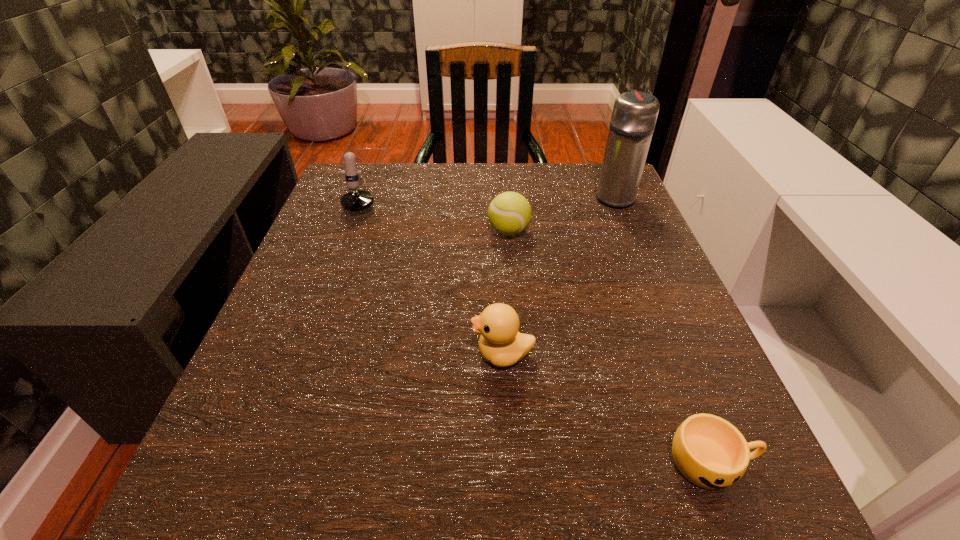
At what (x,y) coordinates should I click in order to perform the action: click on the tallest object. Please return your answer as a coordinate pair (x, y). The image size is (960, 540). Looking at the image, I should click on (634, 115).

Find the location of a particular element. The height and width of the screenshot is (540, 960). the second tallest object is located at coordinates (357, 200).

At what (x,y) coordinates should I click in order to perform the action: click on the leftmost object. Please return your answer as a coordinate pair (x, y). The width and height of the screenshot is (960, 540). Looking at the image, I should click on (357, 200).

Find the location of a particular element. duck is located at coordinates [x=500, y=343].

Where is `the third nearest object`? the third nearest object is located at coordinates (509, 213).

Where is `the nearest object`? the nearest object is located at coordinates (710, 452).

You are a GUI agent. You are given a task and a screenshot of the screen. Output one action in this format:
    pyautogui.click(x=<x>, y=<y>)
    Task: Click on the shortest object
    
    Given the screenshot: What is the action you would take?
    pyautogui.click(x=710, y=452)

Identify the location of vacant space located with a handle on the side of the thermos bottle. (603, 169).

You are a GUI agent. You are given a task and a screenshot of the screen. Output one action in this format:
    pyautogui.click(x=<x>, y=<y>)
    Task: Click on the vacant space situated on the back of the leftmost object
    The image size is (960, 540).
    Given the screenshot: What is the action you would take?
    pyautogui.click(x=374, y=166)

Locate an element on the screen. vacant space situated 0.300m on the face of the duck is located at coordinates (280, 354).